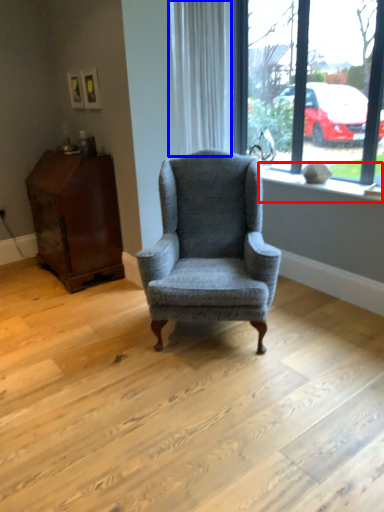
Question: Which point is further to the camera, window sill (highlighted by a red box) or curtain (highlighted by a blue box)?

Choices:
 (A) window sill
 (B) curtain

Answer: (B)